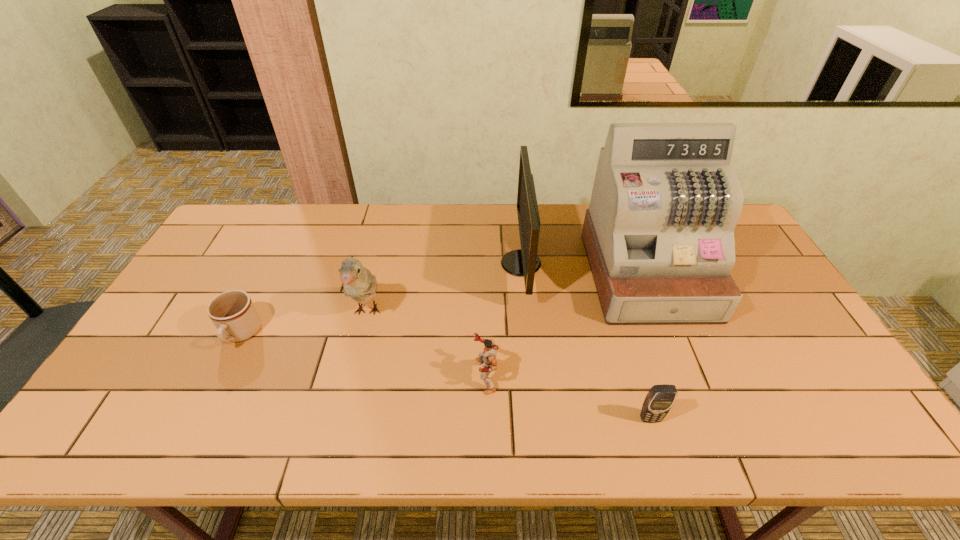
Locate an element on the screen. The image size is (960, 540). the tallest object is located at coordinates (659, 233).

You are a GUI agent. You are given a task and a screenshot of the screen. Output one action in this format:
    pyautogui.click(x=<x>, y=<y>)
    Task: Click on the third object from right to left
    
    Given the screenshot: What is the action you would take?
    pyautogui.click(x=524, y=262)

At what (x,y) coordinates should I click in order to perform the action: click on computer monitor. Please return your answer as a coordinate pair (x, y). Looking at the image, I should click on (524, 262).

Where is `the fifth object from right to left`? This screenshot has height=540, width=960. the fifth object from right to left is located at coordinates (358, 282).

At what (x,y) coordinates should I click in order to perform the action: click on the fourth shortest object. Please return your answer as a coordinate pair (x, y). The width and height of the screenshot is (960, 540). Looking at the image, I should click on (358, 282).

Locate an element on the screen. the fifth farthest object is located at coordinates (487, 358).

You are a GUI agent. You are given a task and a screenshot of the screen. Output one action in this format:
    pyautogui.click(x=<x>, y=<y>)
    Task: Click on the puncher
    This screenshot has height=540, width=960.
    Given the screenshot: What is the action you would take?
    pyautogui.click(x=487, y=358)

Locate an element on the screen. This screenshot has width=960, height=540. cellular telephone is located at coordinates (660, 398).

The height and width of the screenshot is (540, 960). What are the coordinates of `the leftmost object` in the screenshot? It's located at (232, 312).

The height and width of the screenshot is (540, 960). Find the location of `the shortest object`. the shortest object is located at coordinates (232, 312).